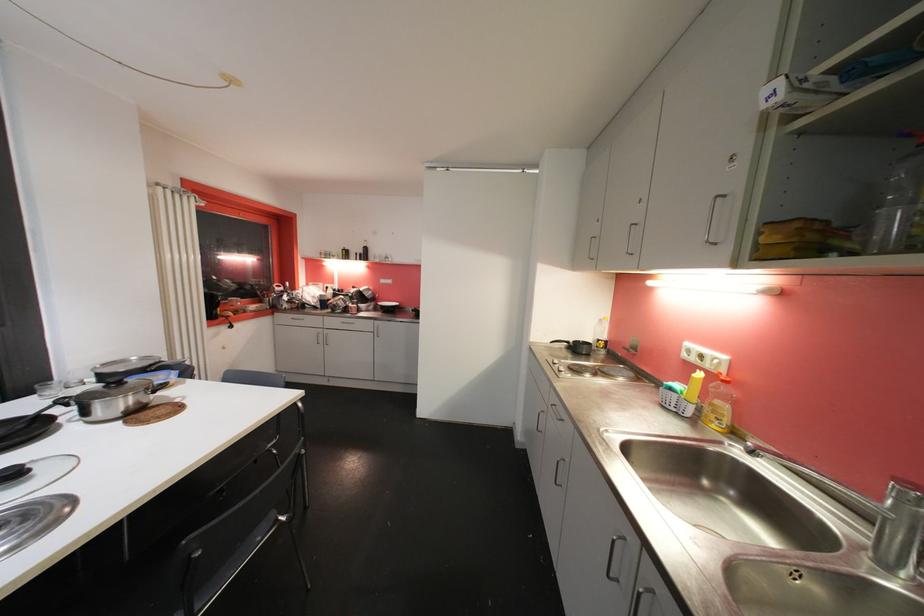
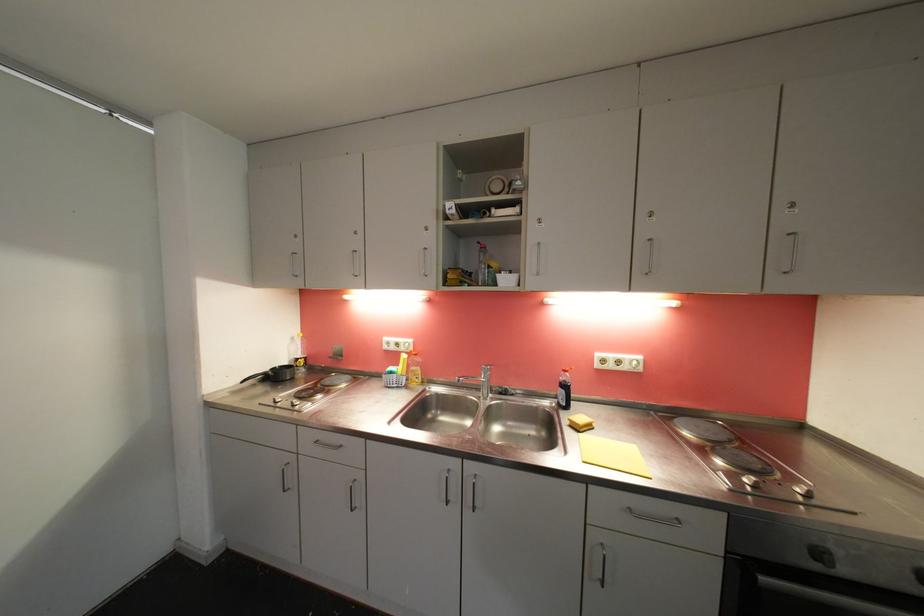
Question: Based on the continuous images, in which direction is the camera rotating? Reply with the corresponding letter.

Choices:
 (A) Left
 (B) Right
 (C) Up
 (D) Down

Answer: (B)